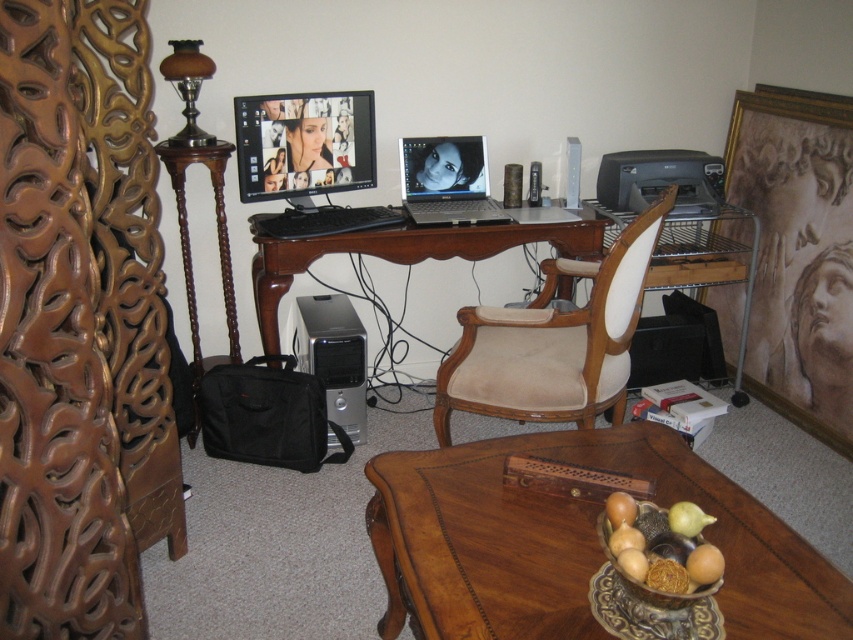
Between mahogany wood coffee table at center and brown wood side table at left, which one has more height?

brown wood side table at left is taller.

Measure the distance from mahogany wood coffee table at center to brown wood side table at left.

1.46 meters

Identify the location of mahogany wood coffee table at center. This screenshot has height=640, width=853. (573, 541).

Who is lower down, brown wood side table at left or black plastic printer at upper right?

brown wood side table at left is lower down.

Is brown wood side table at left bigger than black plastic printer at upper right?

Indeed, brown wood side table at left has a larger size compared to black plastic printer at upper right.

The height and width of the screenshot is (640, 853). In order to click on brown wood side table at left in this screenshot , I will do `click(189, 244)`.

Can you confirm if beige fabric swivel chair at center is shorter than matte plastic monitor at center?

In fact, beige fabric swivel chair at center may be taller than matte plastic monitor at center.

Does beige fabric swivel chair at center lie in front of matte plastic monitor at center?

Yes, it is.

Where is `beige fabric swivel chair at center`? beige fabric swivel chair at center is located at coordinates (554, 340).

Where is `beige fabric swivel chair at center`? beige fabric swivel chair at center is located at coordinates (554, 340).